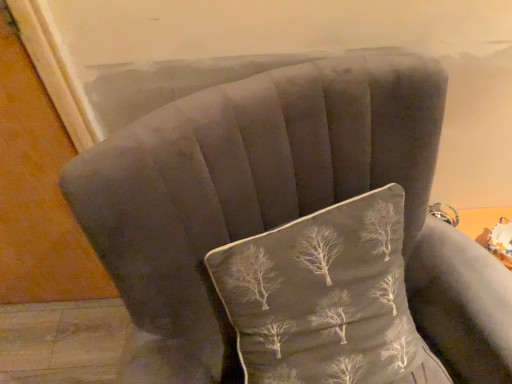
Question: In which direction should I rotate to look at velvet gray pillow with tree pattern at center?

Choices:
 (A) left
 (B) right

Answer: (B)

Question: Should I look upward or downward to see velvet gray pillow with tree pattern at center?

Choices:
 (A) down
 (B) up

Answer: (A)